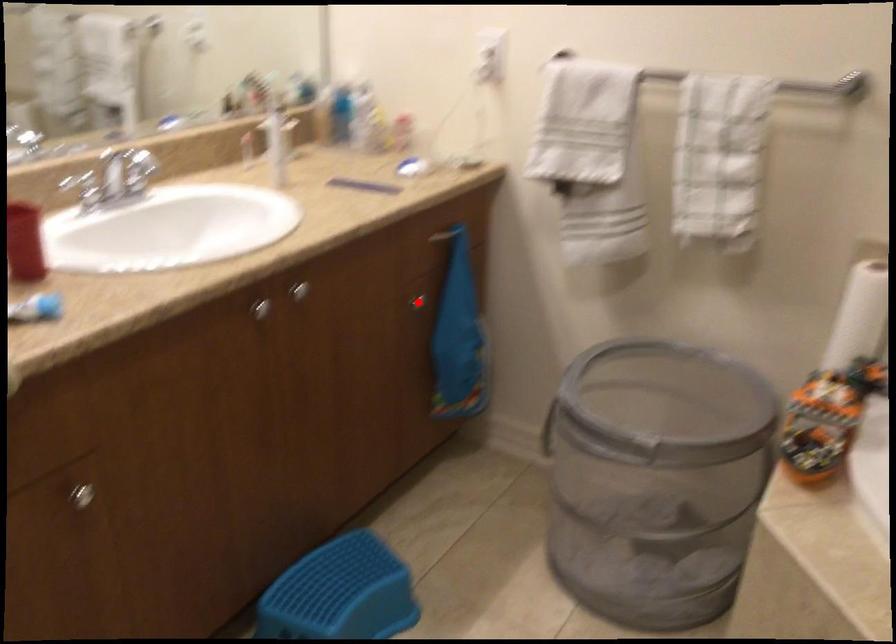
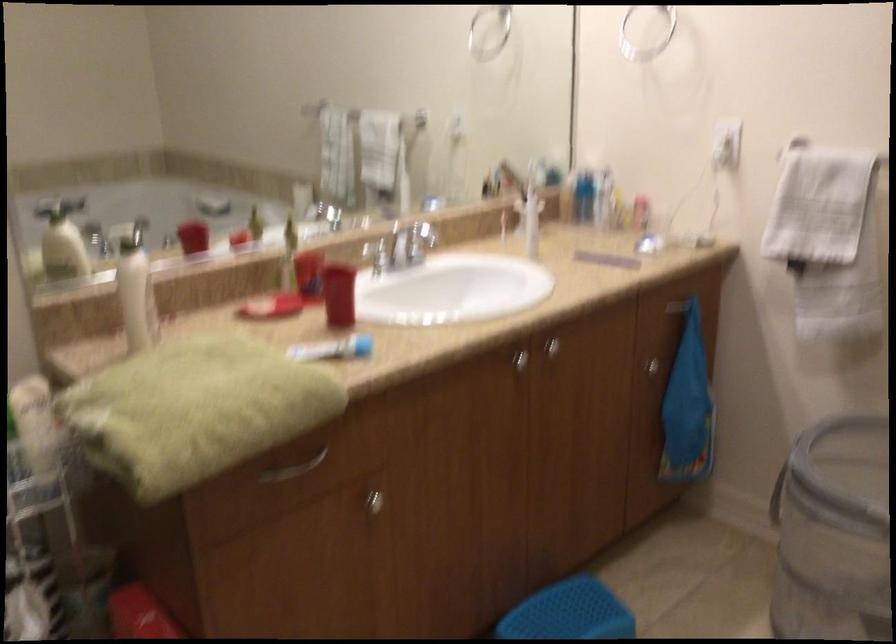
Locate, in the second image, the point that corresponds to the highlighted location in the first image.

(650, 366)